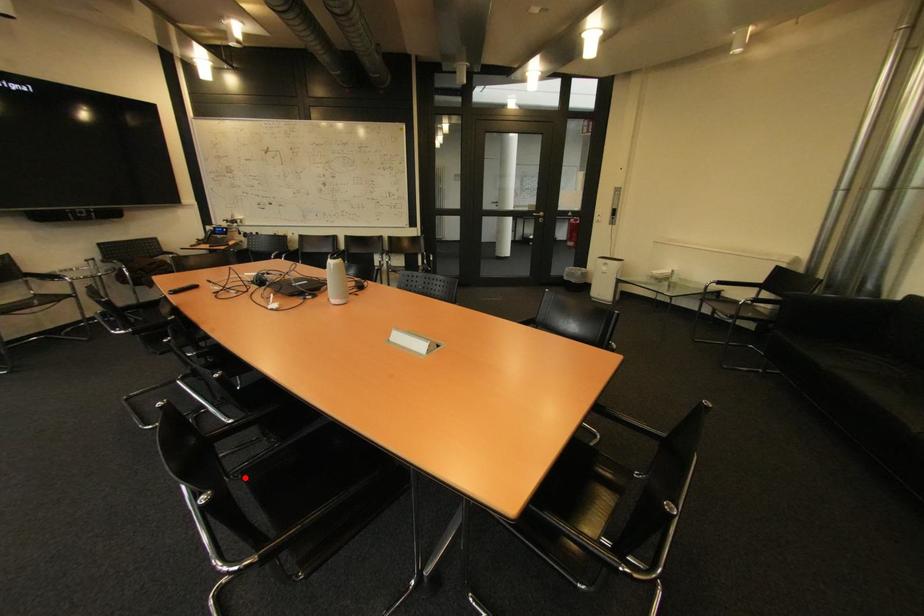
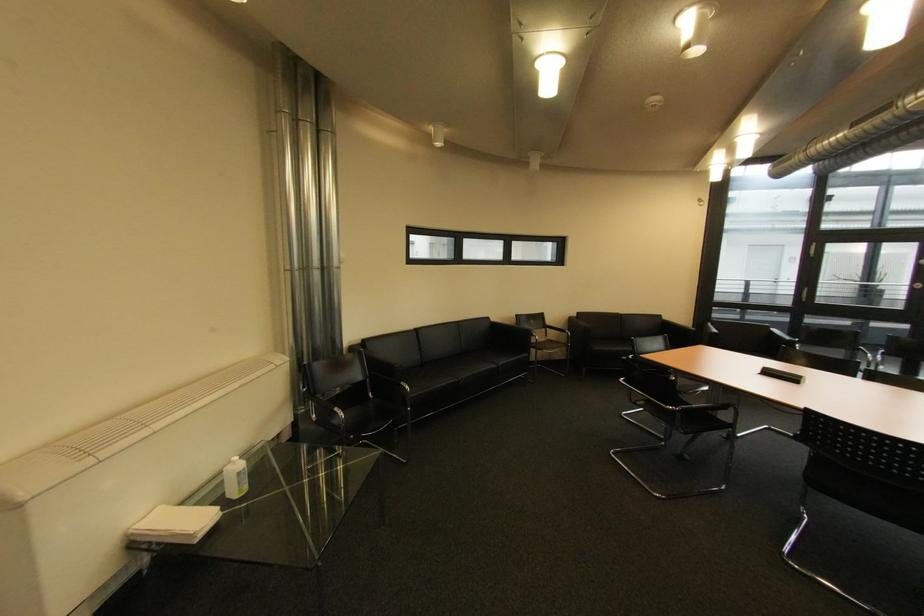
Question: I am providing you with two images of the same scene from different viewpoints. A red point is marked on the first image. At the location where the point appears in image 1, is it still visible in image 2?

Choices:
 (A) Yes
 (B) No

Answer: (B)